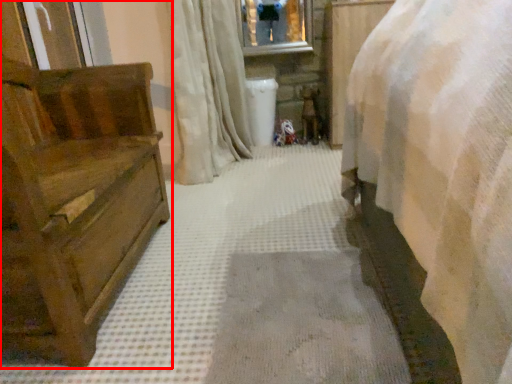
Question: From the image's perspective, what is the correct spatial relationship of furniture (annotated by the red box) in relation to curtain?

Choices:
 (A) below
 (B) above

Answer: (A)